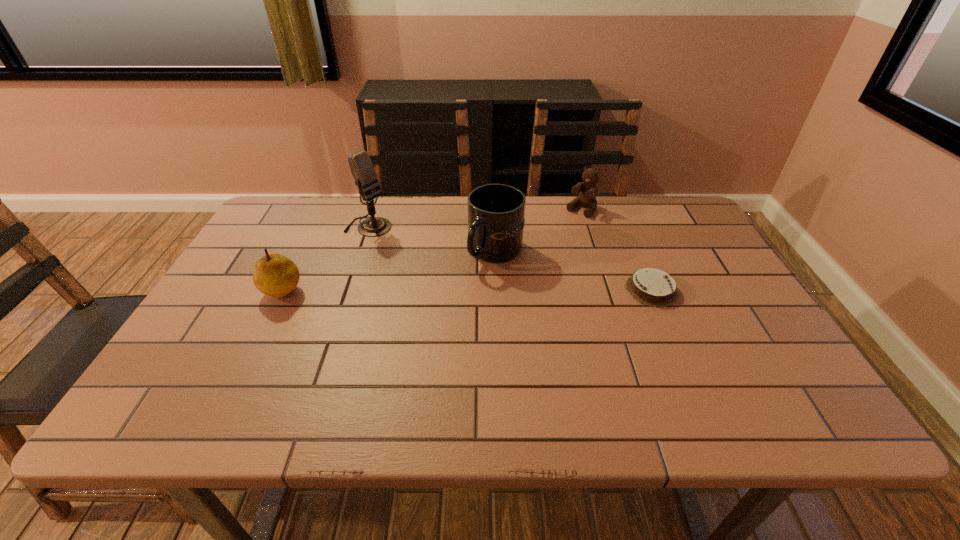
This screenshot has height=540, width=960. In order to click on microphone located at the far edge in this screenshot , I will do `click(361, 166)`.

I want to click on object at the left edge, so click(276, 275).

Where is `object located at the right edge`? The image size is (960, 540). object located at the right edge is located at coordinates tap(652, 287).

In the image, there is a desktop. In order to click on free space at the far edge in this screenshot , I will do `click(417, 213)`.

In the image, there is a desktop. In order to click on blank space at the near edge in this screenshot , I will do `click(509, 368)`.

Where is `vacant region at the left edge of the desktop`? The width and height of the screenshot is (960, 540). vacant region at the left edge of the desktop is located at coordinates (300, 246).

This screenshot has height=540, width=960. I want to click on vacant space at the near right corner of the desktop, so click(x=773, y=364).

I want to click on free space between the pear and the teddy bear, so coord(432,248).

The image size is (960, 540). Find the location of `free space between the second object from left to right and the third object from left to right`. free space between the second object from left to right and the third object from left to right is located at coordinates (432, 239).

Where is `free area in between the mug and the shortest object`? free area in between the mug and the shortest object is located at coordinates [x=573, y=271].